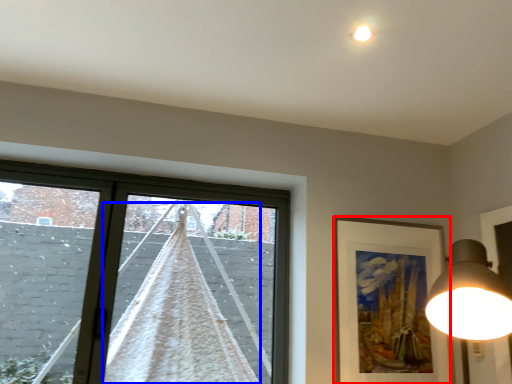
Question: Which of the following is the closest to the observer, picture frame (highlighted by a red box) or curtain (highlighted by a blue box)?

Choices:
 (A) picture frame
 (B) curtain

Answer: (B)